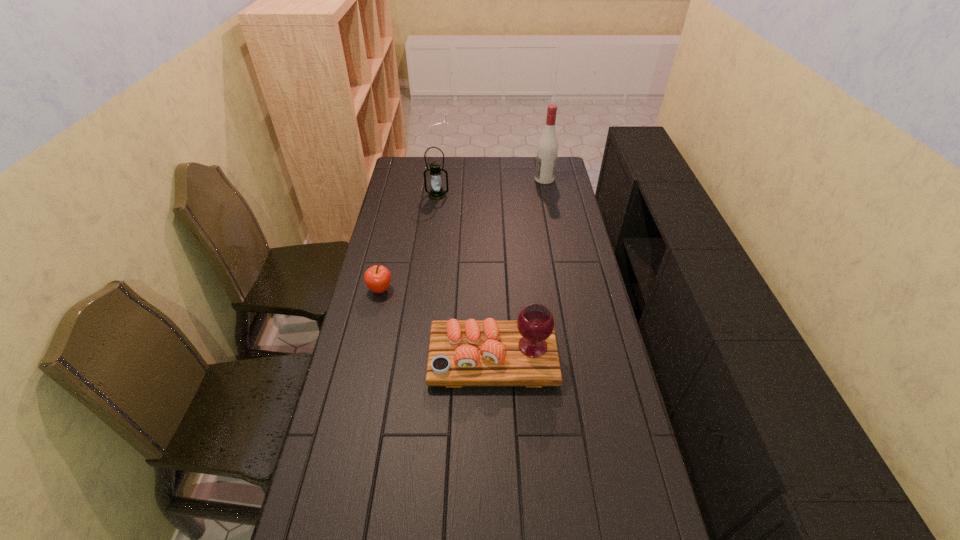
Identify which object is the second nearest to the rightmost object. Please provide its 2D coordinates. Your answer should be formatted as a tuple, i.e. [(x, y)], where the tuple contains the x and y coordinates of a point satisfying the conditions above.

[(377, 278)]

The image size is (960, 540). Find the location of `vacant space that satisfies the following two spatial constraints: 1. on the label of the alcohol; 2. on the side where the second tallest object emits light`. vacant space that satisfies the following two spatial constraints: 1. on the label of the alcohol; 2. on the side where the second tallest object emits light is located at coordinates (x=547, y=195).

Find the location of a particular element. The image size is (960, 540). free space in the image that satisfies the following two spatial constraints: 1. on the front side of the leftmost object; 2. on the right side of the nearest object is located at coordinates coord(365,358).

Image resolution: width=960 pixels, height=540 pixels. Find the location of `vacant region that satisfies the following two spatial constraints: 1. on the side where the third shortest object emits light; 2. on the right side of the platter`. vacant region that satisfies the following two spatial constraints: 1. on the side where the third shortest object emits light; 2. on the right side of the platter is located at coordinates (417, 358).